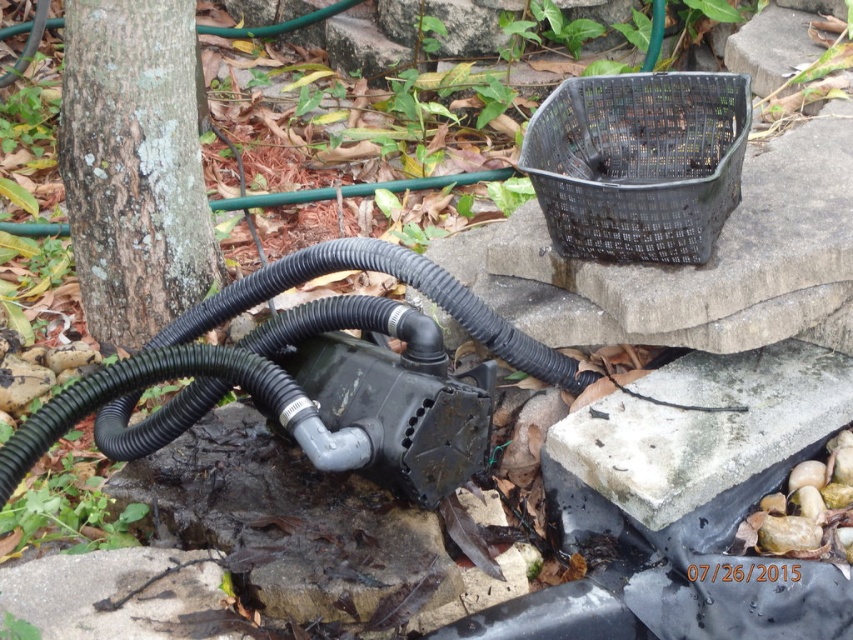
Question: Considering the relative positions of black rubber hose at lower left and black plastic basket at upper right in the image provided, where is black rubber hose at lower left located with respect to black plastic basket at upper right?

Choices:
 (A) right
 (B) left

Answer: (B)

Question: Estimate the real-world distances between objects in this image. Which object is closer to the gray concrete block at lower right?

Choices:
 (A) black plastic basket at upper right
 (B) black rubber hose at lower left

Answer: (A)

Question: Which point is closer to the camera?

Choices:
 (A) black rubber hose at lower left
 (B) gray concrete block at lower right
 (C) black plastic basket at upper right

Answer: (A)

Question: Is the position of black plastic basket at upper right less distant than that of gray concrete block at lower right?

Choices:
 (A) no
 (B) yes

Answer: (A)

Question: Which point appears closest to the camera in this image?

Choices:
 (A) (573, 435)
 (B) (585, 163)

Answer: (A)

Question: Can you confirm if black plastic basket at upper right is positioned to the right of gray concrete block at lower right?

Choices:
 (A) no
 (B) yes

Answer: (A)